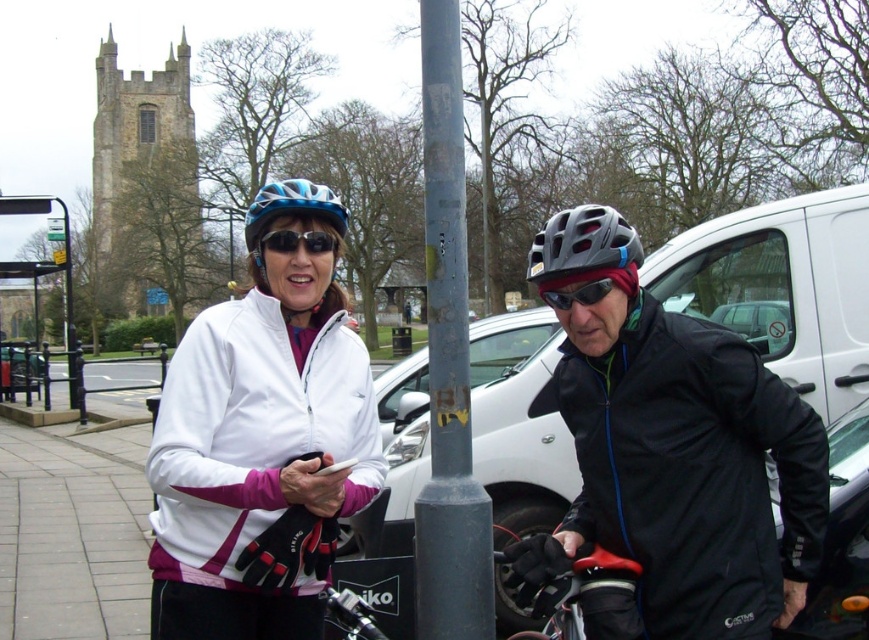
Question: Is matte black jacket at center above matte black sunglasses at center?

Choices:
 (A) no
 (B) yes

Answer: (A)

Question: Which of the following is the closest to the observer?

Choices:
 (A) metallic bus stop at left
 (B) blue matte bicycle helmet at center
 (C) white matte jacket at center

Answer: (B)

Question: Estimate the real-world distances between objects in this image. Which object is closer to the matte gray helmet at center-right?

Choices:
 (A) blue matte bicycle helmet at center
 (B) gray metallic pole at center
 (C) matte black sunglasses at center
 (D) red rubber handlebar at lower center

Answer: (B)

Question: Considering the relative positions of blue matte bicycle helmet at center and metallic bus stop at left in the image provided, where is blue matte bicycle helmet at center located with respect to metallic bus stop at left?

Choices:
 (A) below
 (B) above

Answer: (B)

Question: Which of these objects is positioned farthest from the matte black goggles at center?

Choices:
 (A) matte black sunglasses at center
 (B) metallic bus stop at left

Answer: (B)

Question: Does gray metallic pole at center have a smaller size compared to matte black goggles at center?

Choices:
 (A) no
 (B) yes

Answer: (A)